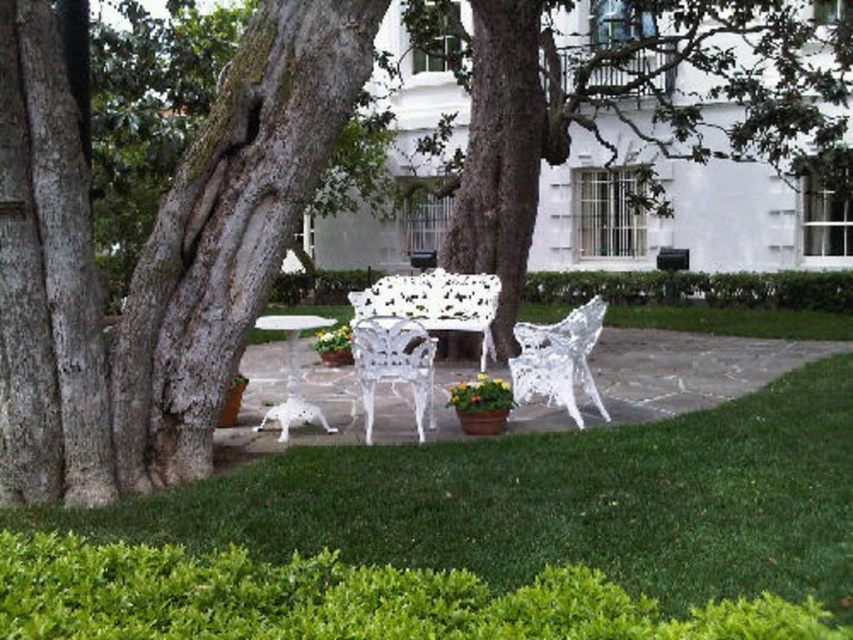
Question: Among these points, which one is farthest from the camera?

Choices:
 (A) (332, 323)
 (B) (175, 214)
 (C) (395, 364)

Answer: (A)

Question: Can you confirm if rough bark tree at left is positioned below white glossy table at center?

Choices:
 (A) no
 (B) yes

Answer: (A)

Question: Which of the following is the closest to the observer?

Choices:
 (A) white wrought iron bench at center
 (B) rough bark tree at left
 (C) white glossy table at center
 (D) green grass at lower center

Answer: (D)

Question: Can you confirm if rough bark tree at left is positioned above white wrought iron chair at center?

Choices:
 (A) yes
 (B) no

Answer: (A)

Question: Can you confirm if rough bark tree at left is smaller than white wrought iron chair at center?

Choices:
 (A) no
 (B) yes

Answer: (A)

Question: Estimate the real-world distances between objects in this image. Which object is closer to the white wrought iron bench at center?

Choices:
 (A) white wrought iron chair at center
 (B) white lace chair at center
 (C) white glossy table at center
 (D) rough bark tree at left

Answer: (B)